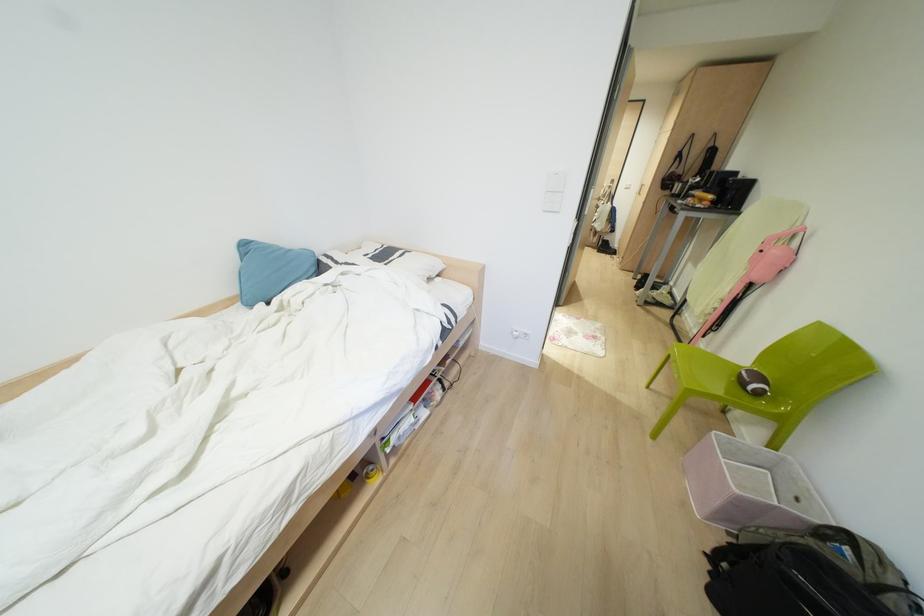
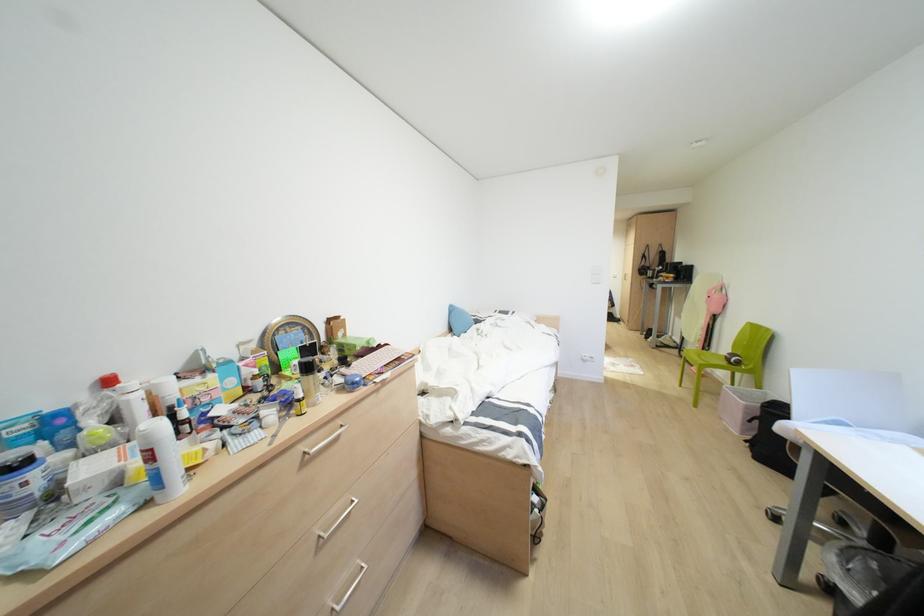
The images are taken continuously from a first-person perspective. In which direction are you moving?

The movement direction of the cameraman is left, backward.